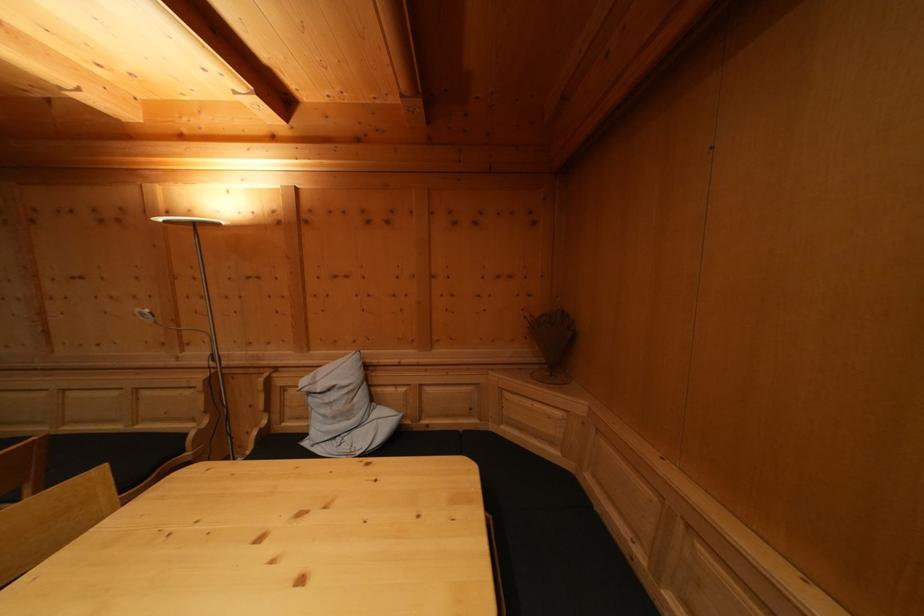
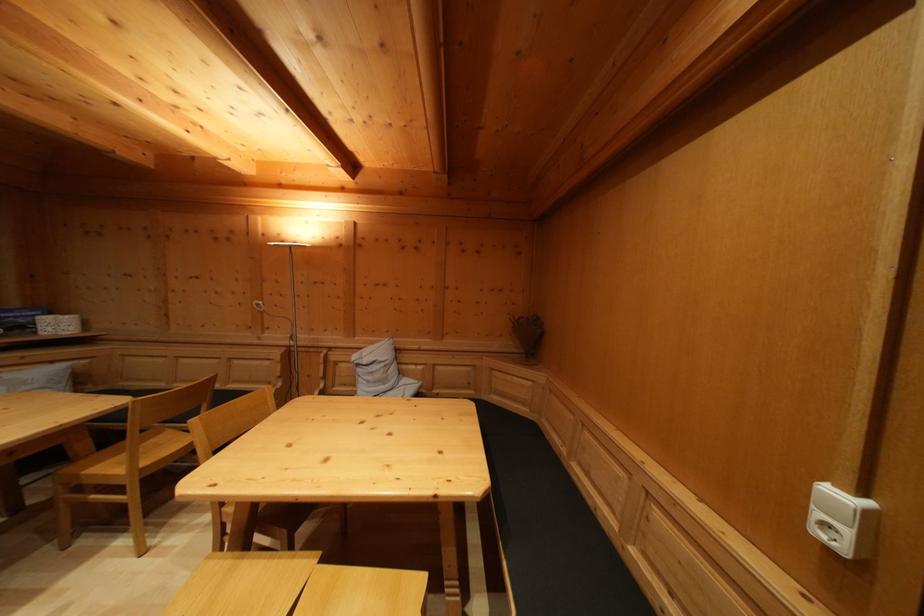
Question: The first image is from the beginning of the video and the second image is from the end. How did the camera likely rotate when shooting the video?

Choices:
 (A) Left
 (B) Right
 (C) Up
 (D) Down

Answer: (C)